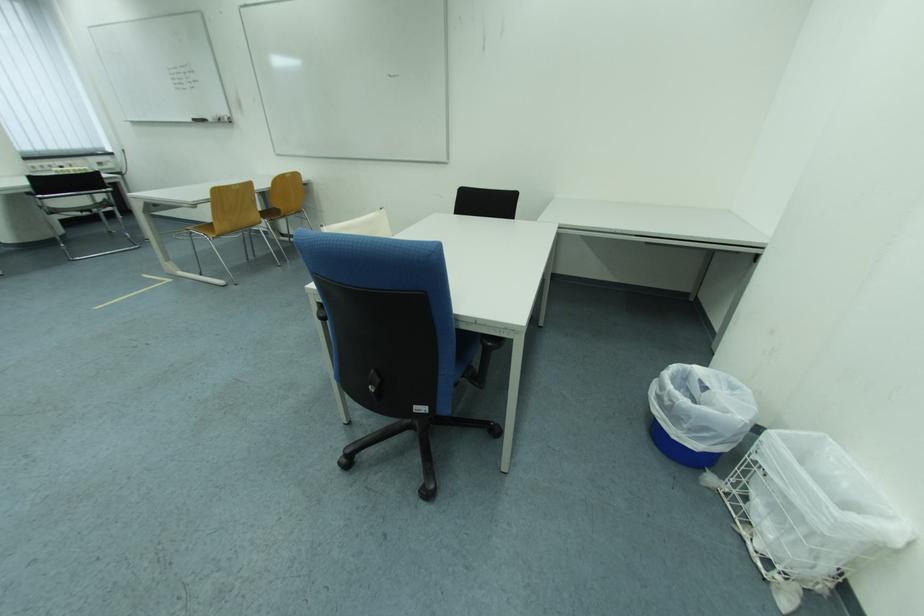
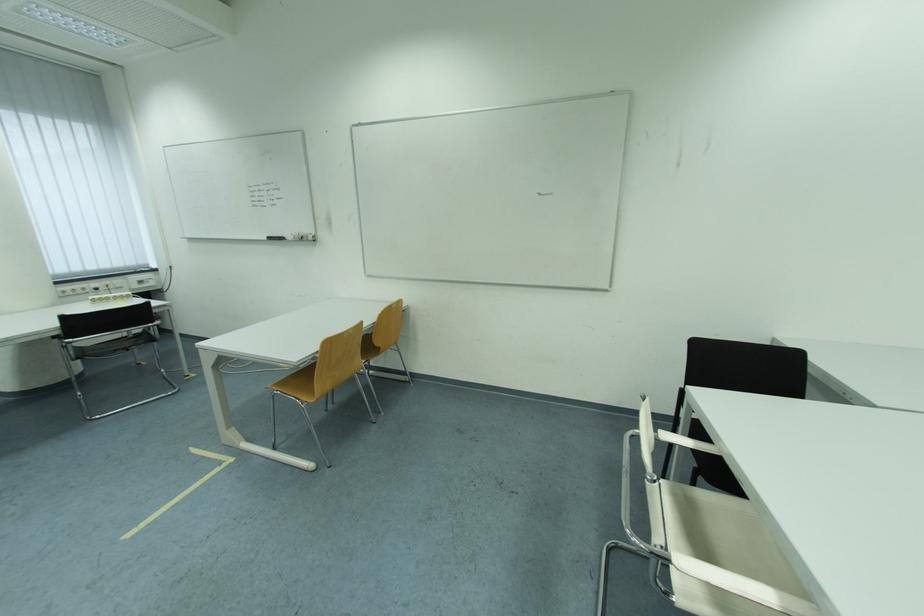
Which direction would the cameraman need to move to produce the second image?

The movement direction of the cameraman is left, forward.